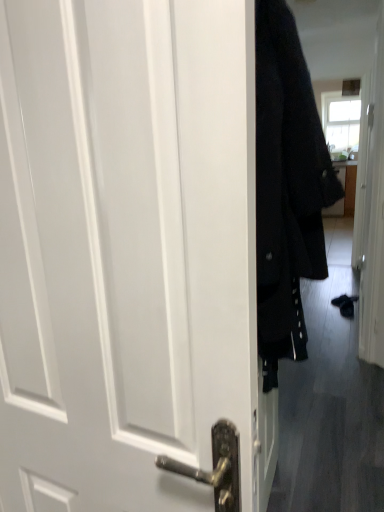
The width and height of the screenshot is (384, 512). Describe the element at coordinates (287, 187) in the screenshot. I see `velvet black coat at right` at that location.

You are a GUI agent. You are given a task and a screenshot of the screen. Output one action in this format:
    pyautogui.click(x=<x>, y=<y>)
    Task: Click on the velvet black coat at right
    Image resolution: width=384 pixels, height=512 pixels.
    Given the screenshot: What is the action you would take?
    pyautogui.click(x=287, y=187)

The width and height of the screenshot is (384, 512). What do you see at coordinates (124, 246) in the screenshot?
I see `white matte door at center` at bounding box center [124, 246].

This screenshot has width=384, height=512. In order to click on white matte door at center in this screenshot , I will do `click(124, 246)`.

The width and height of the screenshot is (384, 512). In order to click on velvet black coat at right in this screenshot , I will do `click(287, 187)`.

Which is more to the right, white matte door at center or velvet black coat at right?

From the viewer's perspective, velvet black coat at right appears more on the right side.

Is white matte door at center in front of or behind velvet black coat at right in the image?

Visually, white matte door at center is located in front of velvet black coat at right.

Considering the positions of point (123, 203) and point (291, 348), is point (123, 203) closer or farther from the camera than point (291, 348)?

Clearly, point (123, 203) is closer to the camera than point (291, 348).

From the image's perspective, which one is positioned lower, white matte door at center or velvet black coat at right?

white matte door at center, from the image's perspective.

From a real-world perspective, does white matte door at center sit lower than velvet black coat at right?

Correct, in the physical world, white matte door at center is lower than velvet black coat at right.

Considering the sizes of white matte door at center and velvet black coat at right in the image, is white matte door at center wider or thinner than velvet black coat at right?

Considering their sizes, white matte door at center looks slimmer than velvet black coat at right.

Considering the relative sizes of white matte door at center and velvet black coat at right in the image provided, is white matte door at center taller than velvet black coat at right?

In fact, white matte door at center may be shorter than velvet black coat at right.

In terms of size, does white matte door at center appear bigger or smaller than velvet black coat at right?

In the image, white matte door at center appears to be smaller than velvet black coat at right.

Is velvet black coat at right a part of white matte door at center?

No.

Is white matte door at center next to velvet black coat at right?

No, white matte door at center is not in contact with velvet black coat at right.

Is white matte door at center aimed at velvet black coat at right?

No.

The height and width of the screenshot is (512, 384). In the image, there is a white matte door at center. In order to click on coat above it (from the image's perspective) in this screenshot , I will do `click(287, 187)`.

Considering the positions of objects velvet black coat at right and white matte door at center in the image provided, who is more to the right, velvet black coat at right or white matte door at center?

From the viewer's perspective, velvet black coat at right appears more on the right side.

Does velvet black coat at right come in front of white matte door at center?

No, velvet black coat at right is behind white matte door at center.

Is point (332, 204) positioned after point (195, 501)?

Yes, it is behind point (195, 501).

From the image's perspective, is velvet black coat at right under white matte door at center?

No, from the image's perspective, velvet black coat at right is not below white matte door at center.

From a real-world perspective, is velvet black coat at right above or below white matte door at center?

Clearly, from a real-world perspective, velvet black coat at right is above white matte door at center.

Is velvet black coat at right wider than white matte door at center?

Yes, velvet black coat at right is wider than white matte door at center.

Who is shorter, velvet black coat at right or white matte door at center?

white matte door at center is shorter.

Considering the relative sizes of velvet black coat at right and white matte door at center in the image provided, is velvet black coat at right smaller than white matte door at center?

Incorrect, velvet black coat at right is not smaller in size than white matte door at center.

Is velvet black coat at right surrounding white matte door at center?

Definitely not — white matte door at center is not inside velvet black coat at right.

Looking at this image, are velvet black coat at right and white matte door at center far apart?

That's not correct — velvet black coat at right is a little close to white matte door at center.

Is velvet black coat at right oriented away from white matte door at center?

No, velvet black coat at right's orientation is not away from white matte door at center.

Can you tell me how much velvet black coat at right and white matte door at center differ in facing direction?

92.2 degrees separate the facing orientations of velvet black coat at right and white matte door at center.

This screenshot has width=384, height=512. In order to click on door located on the left of velvet black coat at right in this screenshot , I will do `click(124, 246)`.

At what (x,y) coordinates should I click in order to perform the action: click on coat lying on the right of white matte door at center. Please return your answer as a coordinate pair (x, y). Looking at the image, I should click on (287, 187).

Where is `coat that is behind the white matte door at center`? This screenshot has height=512, width=384. coat that is behind the white matte door at center is located at coordinates (287, 187).